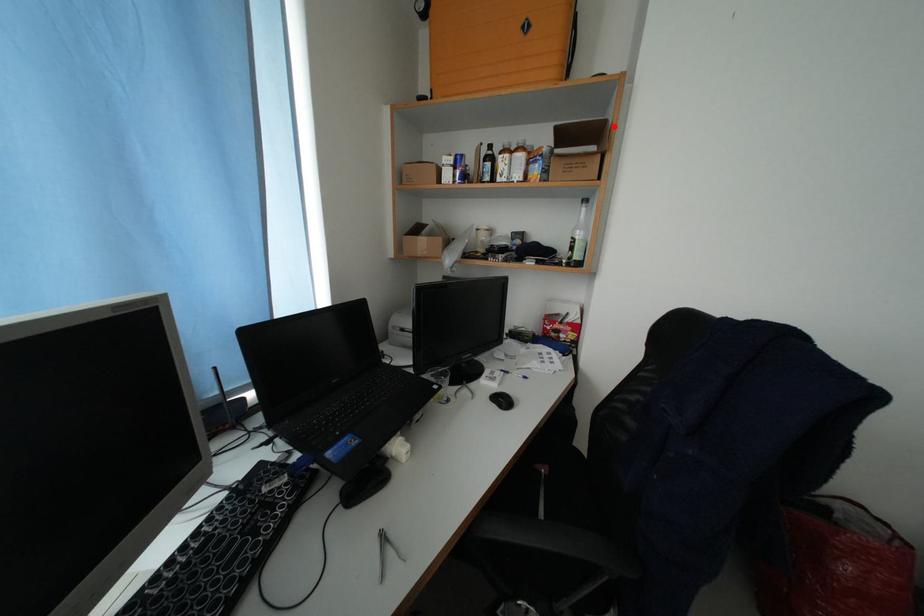
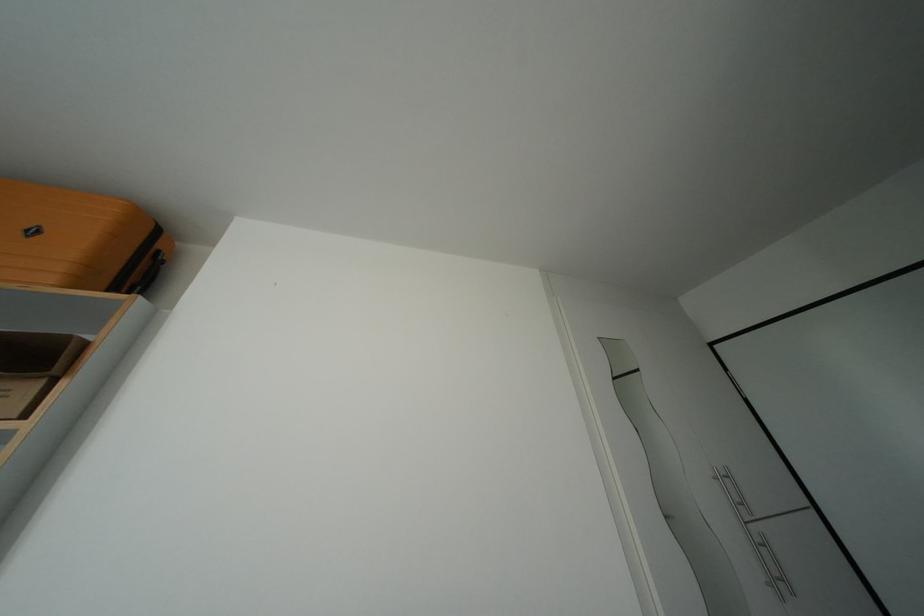
The point at the highlighted location is marked in the first image. Where is the corresponding point in the second image?

(76, 342)